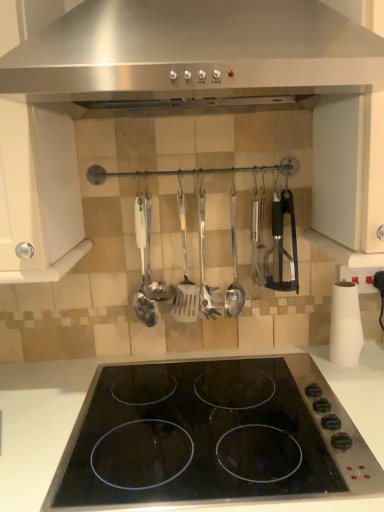
What do you see at coordinates (143, 270) in the screenshot? This screenshot has height=512, width=384. I see `satin silver spatula at center, the 3th spatula from the right` at bounding box center [143, 270].

In order to face satin silver spatula at center, the 3th spatula from the right, should I rotate leftwards or rightwards?

A 6.972 degree turn to the left will do.

Identify the location of black glass electric stove at center. The image size is (384, 512). (208, 437).

The width and height of the screenshot is (384, 512). Identify the location of satin silver spoon at center. (150, 265).

Where is `satin silver spatula at center, which is the 2th spatula from left to right`? This screenshot has width=384, height=512. satin silver spatula at center, which is the 2th spatula from left to right is located at coordinates (185, 277).

From a real-world perspective, who is located lower, satin silver spoon at center or stainless steel range hood at upper center?

A: In real-world perspective, satin silver spoon at center is lower.

Considering their positions, is satin silver spoon at center located in front of or behind stainless steel range hood at upper center?

In the image, satin silver spoon at center appears behind stainless steel range hood at upper center.

Can we say satin silver spoon at center lies outside stainless steel range hood at upper center?

Indeed, satin silver spoon at center is completely outside stainless steel range hood at upper center.

Is satin silver spoon at center oriented towards stainless steel range hood at upper center?

No, satin silver spoon at center does not turn towards stainless steel range hood at upper center.

From the picture: From a real-world perspective, is satin silver spatula at center, which is the 1th spatula from right to left, positioned under white matte paper towel at right based on gravity?

Actually, satin silver spatula at center, which is the 1th spatula from right to left, is physically above white matte paper towel at right in the real world.

Is satin silver spatula at center, which is the 1th spatula from right to left, surrounding white matte paper towel at right?

No, satin silver spatula at center, which is the 1th spatula from right to left, does not contain white matte paper towel at right.

How many degrees apart are the facing directions of satin silver spatula at center, the third spatula in the left-to-right sequence, and white matte paper towel at right?

The angular difference between satin silver spatula at center, the third spatula in the left-to-right sequence, and white matte paper towel at right is 2.74 degrees.

Could you measure the distance between satin silver spatula at center, the third spatula in the left-to-right sequence, and white matte paper towel at right?

satin silver spatula at center, the third spatula in the left-to-right sequence, and white matte paper towel at right are 10.97 inches apart.

Is black glass electric stove at center not near stainless steel range hood at upper center?

black glass electric stove at center is actually quite close to stainless steel range hood at upper center.

Based on the photo, can you confirm if black glass electric stove at center is bigger than stainless steel range hood at upper center?

Correct, black glass electric stove at center is larger in size than stainless steel range hood at upper center.

The image size is (384, 512). I want to click on gas stove lying below the stainless steel range hood at upper center (from the image's perspective), so click(208, 437).

Could you tell me if black glass electric stove at center is facing satin silver spatula at center, which is the 1th spatula from right to left?

No, black glass electric stove at center is not turned towards satin silver spatula at center, which is the 1th spatula from right to left.

Is black glass electric stove at center behind satin silver spatula at center, which is the 1th spatula from right to left?

No, it is not.

How different are the orientations of black glass electric stove at center and satin silver spatula at center, the third spatula in the left-to-right sequence, in degrees?

black glass electric stove at center and satin silver spatula at center, the third spatula in the left-to-right sequence, are facing 1.54 degrees away from each other.

From their relative heights in the image, would you say black glass electric stove at center is taller or shorter than satin silver spatula at center, the third spatula in the left-to-right sequence?

black glass electric stove at center is taller than satin silver spatula at center, the third spatula in the left-to-right sequence.

Is satin silver spatula at center, the third spatula in the left-to-right sequence, completely or partially outside of satin silver spoon at center?

satin silver spatula at center, the third spatula in the left-to-right sequence, lies outside satin silver spoon at center's area.

Find the location of a particular element. The width and height of the screenshot is (384, 512). utensil located above the satin silver spatula at center, which is the 1th spatula from right to left (from a real-world perspective) is located at coordinates (150, 265).

Is satin silver spatula at center, which is the 1th spatula from right to left, far away from satin silver spoon at center?

No, satin silver spatula at center, which is the 1th spatula from right to left, is not far away from satin silver spoon at center.

Looking at this image, who is smaller, satin silver spatula at center, which is the 1th spatula from right to left, or satin silver spoon at center?

Smaller between the two is satin silver spatula at center, which is the 1th spatula from right to left.

From the image's perspective, who appears lower, satin silver spatula at center, which is the second spatula from right to left, or satin silver spatula at center, which is the 1th spatula from right to left?

satin silver spatula at center, which is the second spatula from right to left, from the image's perspective.

Is satin silver spatula at center, which is the second spatula from right to left, wider than satin silver spatula at center, which is the 1th spatula from right to left?

No, satin silver spatula at center, which is the second spatula from right to left, is not wider than satin silver spatula at center, which is the 1th spatula from right to left.

Does satin silver spatula at center, which is the second spatula from right to left, turn towards satin silver spatula at center, the third spatula in the left-to-right sequence?

No, satin silver spatula at center, which is the second spatula from right to left, is not facing towards satin silver spatula at center, the third spatula in the left-to-right sequence.

Considering the relative sizes of satin silver spatula at center, which is the 2th spatula from left to right, and satin silver spatula at center, which is the 1th spatula from right to left, in the image provided, is satin silver spatula at center, which is the 2th spatula from left to right, smaller than satin silver spatula at center, which is the 1th spatula from right to left,?

Incorrect, satin silver spatula at center, which is the 2th spatula from left to right, is not smaller in size than satin silver spatula at center, which is the 1th spatula from right to left.

How distant is satin silver spatula at center, which is the 1th spatula from right to left, from stainless steel range hood at upper center?

A distance of 20.66 inches exists between satin silver spatula at center, which is the 1th spatula from right to left, and stainless steel range hood at upper center.

From the image's perspective, between satin silver spatula at center, which is the 1th spatula from right to left, and stainless steel range hood at upper center, who is located below?

satin silver spatula at center, which is the 1th spatula from right to left, from the image's perspective.

From a real-world perspective, is satin silver spatula at center, the third spatula in the left-to-right sequence, located beneath stainless steel range hood at upper center?

Yes, from a real-world perspective, satin silver spatula at center, the third spatula in the left-to-right sequence, is beneath stainless steel range hood at upper center.

Does satin silver spatula at center, the third spatula in the left-to-right sequence, turn towards stainless steel range hood at upper center?

No, satin silver spatula at center, the third spatula in the left-to-right sequence, is not aimed at stainless steel range hood at upper center.

Locate an element on the screen. utensil below the stainless steel range hood at upper center (from a real-world perspective) is located at coordinates (150, 265).

In order to click on paper towel on the right of the satin silver spatula at center, which is the 1th spatula from right to left in this screenshot , I will do `click(345, 325)`.

Looking at the image, which one is located closer to satin silver spoon at center, satin silver spatula at center, which is the 1th spatula from right to left, or black glass electric stove at center?

satin silver spatula at center, which is the 1th spatula from right to left, is positioned closer to the anchor satin silver spoon at center.

Based on their spatial positions, is satin silver spatula at center, the 3th spatula from the right, or black glass electric stove at center closer to satin silver spatula at center, the third spatula in the left-to-right sequence?

Among the two, satin silver spatula at center, the 3th spatula from the right, is located nearer to satin silver spatula at center, the third spatula in the left-to-right sequence.

Considering their positions, is satin silver spatula at center, which is counted as the 1th spatula, starting from the left, positioned closer to satin silver spatula at center, which is the second spatula from right to left, than white matte paper towel at right?

satin silver spatula at center, which is counted as the 1th spatula, starting from the left.

Consider the image. Considering their positions, is satin silver spatula at center, which is counted as the 1th spatula, starting from the left, positioned further to satin silver spoon at center than white matte paper towel at right?

white matte paper towel at right is positioned further to the anchor satin silver spoon at center.

Considering their positions, is satin silver spatula at center, which is the 2th spatula from left to right, positioned further to satin silver spoon at center than satin silver spatula at center, the third spatula in the left-to-right sequence?

The object further to satin silver spoon at center is satin silver spatula at center, the third spatula in the left-to-right sequence.

When comparing their distances from satin silver spatula at center, the 3th spatula from the right, does black glass electric stove at center or satin silver spoon at center seem further?

black glass electric stove at center.

Considering their positions, is white matte paper towel at right positioned closer to stainless steel range hood at upper center than satin silver spoon at center?

Based on the image, satin silver spoon at center appears to be nearer to stainless steel range hood at upper center.

Looking at the image, which one is located closer to satin silver spatula at center, the 3th spatula from the right, satin silver spatula at center, which is the 2th spatula from left to right, or satin silver spatula at center, the third spatula in the left-to-right sequence?

satin silver spatula at center, which is the 2th spatula from left to right, is positioned closer to the anchor satin silver spatula at center, the 3th spatula from the right.

I want to click on spatula between satin silver spatula at center, which is counted as the 1th spatula, starting from the left, and satin silver spatula at center, the third spatula in the left-to-right sequence, from left to right, so click(185, 277).

Locate an element on the screen. The height and width of the screenshot is (512, 384). paper towel between stainless steel range hood at upper center and satin silver spatula at center, which is the 1th spatula from right to left, from front to back is located at coordinates (345, 325).

In order to click on paper towel between stainless steel range hood at upper center and satin silver spoon at center along the z-axis in this screenshot , I will do point(345,325).

Where is `utensil located between stainless steel range hood at upper center and satin silver spatula at center, which is the second spatula from right to left, in the depth direction`? This screenshot has width=384, height=512. utensil located between stainless steel range hood at upper center and satin silver spatula at center, which is the second spatula from right to left, in the depth direction is located at coordinates (150, 265).